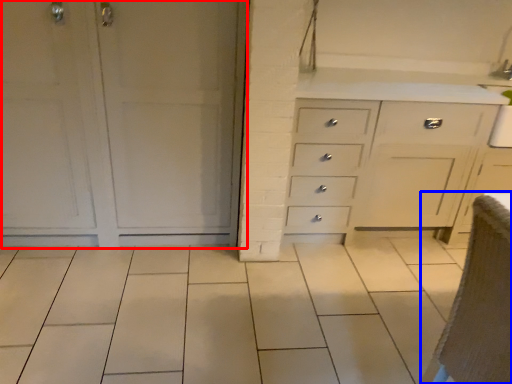
Question: Among these objects, which one is farthest to the camera, door (highlighted by a red box) or armchair (highlighted by a blue box)?

Choices:
 (A) door
 (B) armchair

Answer: (A)